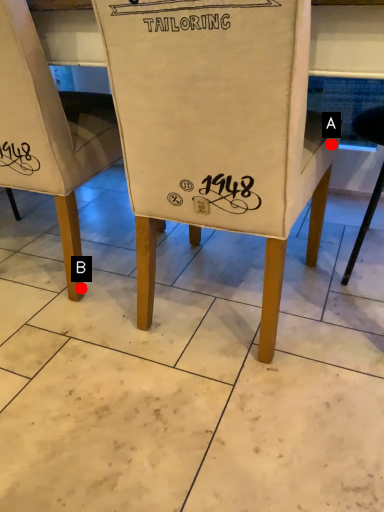
Question: Two points are circled on the image, labeled by A and B beside each circle. Which point is farther from the camera taking this photo?

Choices:
 (A) A is further
 (B) B is further

Answer: (B)